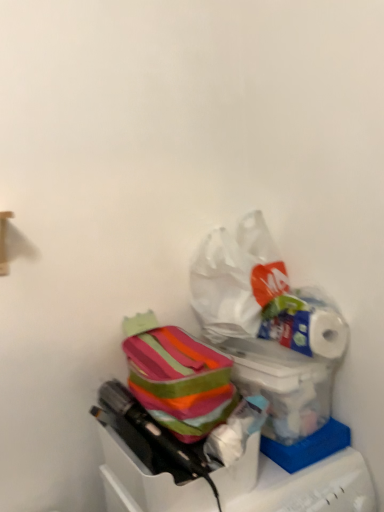
Question: Can you confirm if striped fabric lunchbox at center is shorter than white glossy toilet paper at upper right?

Choices:
 (A) yes
 (B) no

Answer: (B)

Question: Considering the relative sizes of striped fabric lunchbox at center and white glossy toilet paper at upper right in the image provided, is striped fabric lunchbox at center taller than white glossy toilet paper at upper right?

Choices:
 (A) no
 (B) yes

Answer: (B)

Question: Does striped fabric lunchbox at center come behind white glossy toilet paper at upper right?

Choices:
 (A) yes
 (B) no

Answer: (B)

Question: Is striped fabric lunchbox at center thinner than white glossy toilet paper at upper right?

Choices:
 (A) yes
 (B) no

Answer: (B)

Question: Is striped fabric lunchbox at center not near white glossy toilet paper at upper right?

Choices:
 (A) no
 (B) yes

Answer: (A)

Question: From the image's perspective, is striped fabric lunchbox at center located above or below translucent plastic bag at lower right, the 1th box in the top-to-bottom sequence?

Choices:
 (A) below
 (B) above

Answer: (B)

Question: From a real-world perspective, is striped fabric lunchbox at center positioned above or below translucent plastic bag at lower right, the 1th box in the top-to-bottom sequence?

Choices:
 (A) above
 (B) below

Answer: (A)

Question: In terms of width, does striped fabric lunchbox at center look wider or thinner when compared to translucent plastic bag at lower right, the 2th box when ordered from bottom to top?

Choices:
 (A) thin
 (B) wide

Answer: (B)

Question: Is point (195, 349) positioned closer to the camera than point (309, 382)?

Choices:
 (A) farther
 (B) closer

Answer: (A)

Question: From a real-world perspective, is white glossy toilet paper at upper right positioned above or below white plastic bag at upper center?

Choices:
 (A) above
 (B) below

Answer: (B)

Question: In the image, is white glossy toilet paper at upper right positioned in front of or behind white plastic bag at upper center?

Choices:
 (A) behind
 (B) front

Answer: (B)

Question: Is white glossy toilet paper at upper right situated inside white plastic bag at upper center or outside?

Choices:
 (A) inside
 (B) outside

Answer: (B)

Question: Does point (269, 309) appear closer or farther from the camera than point (226, 292)?

Choices:
 (A) closer
 (B) farther

Answer: (A)

Question: Does point (299, 423) appear closer or farther from the camera than point (155, 370)?

Choices:
 (A) farther
 (B) closer

Answer: (A)

Question: In terms of size, does translucent plastic bag at lower right, the 1th box in the top-to-bottom sequence, appear bigger or smaller than striped fabric lunchbox at center?

Choices:
 (A) small
 (B) big

Answer: (A)